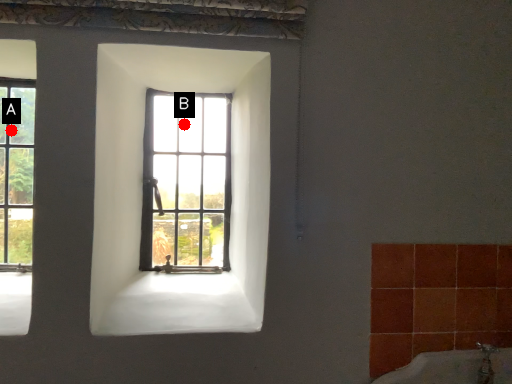
Question: Two points are circled on the image, labeled by A and B beside each circle. Which point appears farthest from the camera in this image?

Choices:
 (A) A is further
 (B) B is further

Answer: (A)